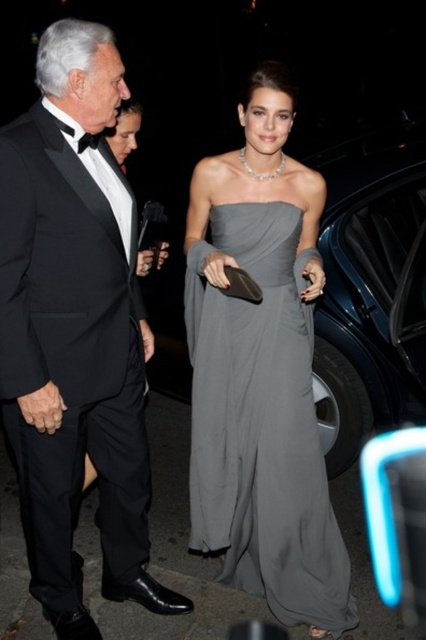
Question: Observing the image, what is the correct spatial positioning of black satin tuxedo at left in reference to gray satin dress at center?

Choices:
 (A) below
 (B) above

Answer: (B)

Question: Is black satin tuxedo at left bigger than gray satin dress at center?

Choices:
 (A) yes
 (B) no

Answer: (A)

Question: Can you confirm if black satin tuxedo at left is smaller than gray satin dress at center?

Choices:
 (A) no
 (B) yes

Answer: (A)

Question: Which object is closer to the camera taking this photo?

Choices:
 (A) black satin tuxedo at left
 (B) gray satin dress at center

Answer: (A)